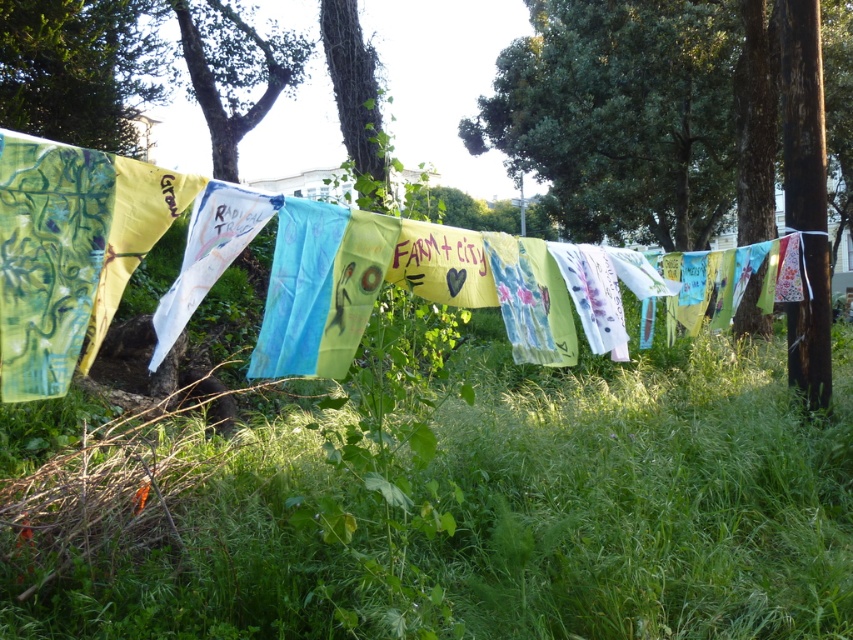
Question: Among these objects, which one is nearest to the camera?

Choices:
 (A) textile banners at center
 (B) green leafy tree at center

Answer: (A)

Question: Can you confirm if textile banners at center is thinner than green leafy tree at upper left?

Choices:
 (A) no
 (B) yes

Answer: (B)

Question: Where is green leafy tree at upper left located in relation to green leafy tree at center in the image?

Choices:
 (A) right
 (B) left

Answer: (B)

Question: Which of the following is the farthest from the observer?

Choices:
 (A) textile banners at center
 (B) green leafy tree at upper left

Answer: (B)

Question: Which point is closer to the camera taking this photo?

Choices:
 (A) (86, 83)
 (B) (202, 220)

Answer: (B)

Question: Can you confirm if green grass at lower center is wider than green leafy tree at center?

Choices:
 (A) no
 (B) yes

Answer: (B)